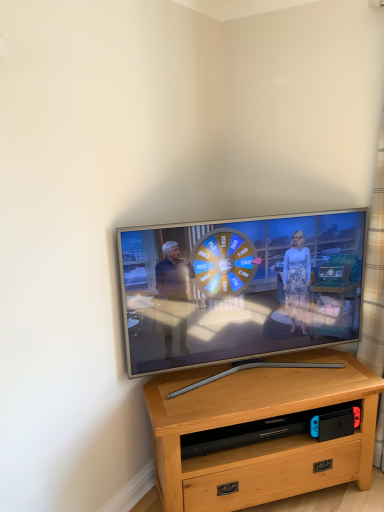
Question: From the image's perspective, is light brown wood desk at center located above plaid fabric curtain at right?

Choices:
 (A) no
 (B) yes

Answer: (A)

Question: Can you confirm if light brown wood desk at center is positioned to the right of plaid fabric curtain at right?

Choices:
 (A) yes
 (B) no

Answer: (B)

Question: Considering the relative sizes of light brown wood desk at center and plaid fabric curtain at right in the image provided, is light brown wood desk at center shorter than plaid fabric curtain at right?

Choices:
 (A) no
 (B) yes

Answer: (B)

Question: Is the position of light brown wood desk at center more distant than that of plaid fabric curtain at right?

Choices:
 (A) yes
 (B) no

Answer: (A)

Question: From a real-world perspective, is light brown wood desk at center physically below plaid fabric curtain at right?

Choices:
 (A) yes
 (B) no

Answer: (A)

Question: Considering the relative sizes of light brown wood desk at center and plaid fabric curtain at right in the image provided, is light brown wood desk at center taller than plaid fabric curtain at right?

Choices:
 (A) yes
 (B) no

Answer: (B)

Question: From a real-world perspective, is silver metallic tv at center located beneath light brown wood desk at center?

Choices:
 (A) no
 (B) yes

Answer: (A)

Question: Is light brown wood desk at center completely or partially inside silver metallic tv at center?

Choices:
 (A) yes
 (B) no

Answer: (B)

Question: From the image's perspective, is silver metallic tv at center over light brown wood desk at center?

Choices:
 (A) no
 (B) yes

Answer: (B)

Question: Considering the relative sizes of silver metallic tv at center and light brown wood desk at center in the image provided, is silver metallic tv at center smaller than light brown wood desk at center?

Choices:
 (A) yes
 (B) no

Answer: (A)

Question: Is silver metallic tv at center to the left of light brown wood desk at center from the viewer's perspective?

Choices:
 (A) yes
 (B) no

Answer: (A)

Question: From the image's perspective, is silver metallic tv at center under light brown wood desk at center?

Choices:
 (A) no
 (B) yes

Answer: (A)

Question: Is plaid fabric curtain at right looking in the opposite direction of light brown wood desk at center?

Choices:
 (A) yes
 (B) no

Answer: (B)